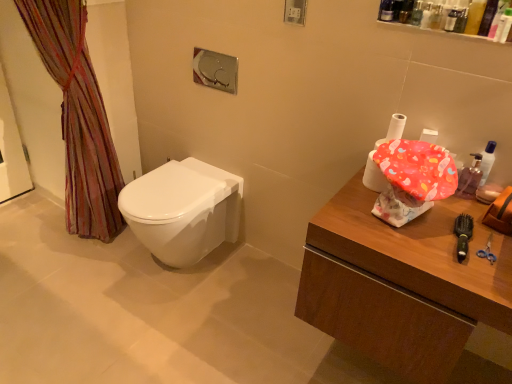
The width and height of the screenshot is (512, 384). Identify the location of vacant area situated to the left side of multicolored fabric curtain at left. (31, 236).